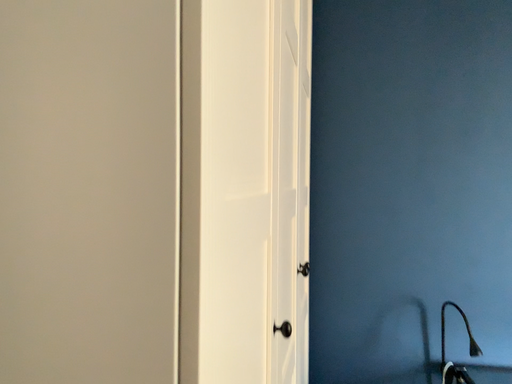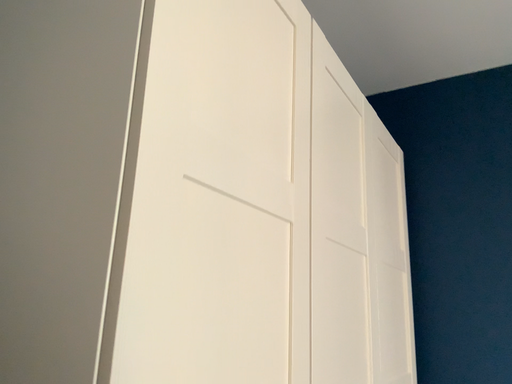
Question: How did the camera likely rotate when shooting the video?

Choices:
 (A) rotated right
 (B) rotated left

Answer: (B)